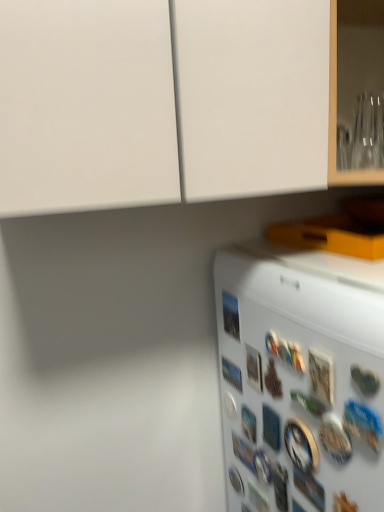
Question: From a real-world perspective, is metallic silver button at lower right, which is the tenth button in back-to-front order, located beneath white plastic button at lower center, marked as the twelfth button in a front-to-back arrangement?

Choices:
 (A) no
 (B) yes

Answer: (B)

Question: Is white plastic button at lower center, marked as the twelfth button in a front-to-back arrangement, at the back of metallic silver button at lower right, which is the tenth button in back-to-front order?

Choices:
 (A) no
 (B) yes

Answer: (A)

Question: Would you say metallic silver button at lower right, which is counted as the 4th button, starting from the front, is outside white plastic button at lower center, which is the second button in back-to-front order?

Choices:
 (A) no
 (B) yes

Answer: (B)

Question: From the image's perspective, is metallic silver button at lower right, which is counted as the 4th button, starting from the front, below white plastic button at lower center, marked as the twelfth button in a front-to-back arrangement?

Choices:
 (A) yes
 (B) no

Answer: (A)

Question: Is the position of metallic silver button at lower right, which is the tenth button in back-to-front order, more distant than that of white plastic button at lower center, marked as the twelfth button in a front-to-back arrangement?

Choices:
 (A) yes
 (B) no

Answer: (B)

Question: Visually, is metallic silver button at lower right, the eighth button viewed from the back, positioned to the left or to the right of metallic photo at right, the seventh button from the back?

Choices:
 (A) left
 (B) right

Answer: (B)

Question: From the image's perspective, is metallic silver button at lower right, arranged as the sixth button when viewed from the front, located above or below metallic photo at right, the seventh button from the back?

Choices:
 (A) above
 (B) below

Answer: (B)

Question: Considering the positions of metallic silver button at lower right, arranged as the sixth button when viewed from the front, and metallic photo at right, arranged as the seventh button when viewed from the front, in the image, is metallic silver button at lower right, arranged as the sixth button when viewed from the front, bigger or smaller than metallic photo at right, arranged as the seventh button when viewed from the front,?

Choices:
 (A) big
 (B) small

Answer: (A)

Question: Is metallic silver button at lower right, arranged as the sixth button when viewed from the front, taller or shorter than metallic photo at right, the seventh button from the back?

Choices:
 (A) tall
 (B) short

Answer: (B)

Question: Based on their positions, is blue glossy button at lower center, the sixth button positioned from the back, located to the left or right of white matte refrigerator at lower right?

Choices:
 (A) right
 (B) left

Answer: (B)

Question: From a real-world perspective, is blue glossy button at lower center, which appears as the eighth button when viewed from the front, physically located above or below white matte refrigerator at lower right?

Choices:
 (A) above
 (B) below

Answer: (A)

Question: Considering the positions of point (243, 419) and point (355, 322), is point (243, 419) closer or farther from the camera than point (355, 322)?

Choices:
 (A) farther
 (B) closer

Answer: (A)

Question: In terms of width, does blue glossy button at lower center, the sixth button positioned from the back, look wider or thinner when compared to white matte refrigerator at lower right?

Choices:
 (A) wide
 (B) thin

Answer: (B)

Question: Considering the positions of metallic silver button at lower right, which is counted as the 4th button, starting from the front, and metallic silver button at lower right, the 3th button from the front, in the image, is metallic silver button at lower right, which is counted as the 4th button, starting from the front, wider or thinner than metallic silver button at lower right, the 3th button from the front,?

Choices:
 (A) wide
 (B) thin

Answer: (B)

Question: Considering the positions of metallic silver button at lower right, which is counted as the 4th button, starting from the front, and metallic silver button at lower right, the 11th button in the back-to-front sequence, in the image, is metallic silver button at lower right, which is counted as the 4th button, starting from the front, taller or shorter than metallic silver button at lower right, the 11th button in the back-to-front sequence,?

Choices:
 (A) tall
 (B) short

Answer: (B)